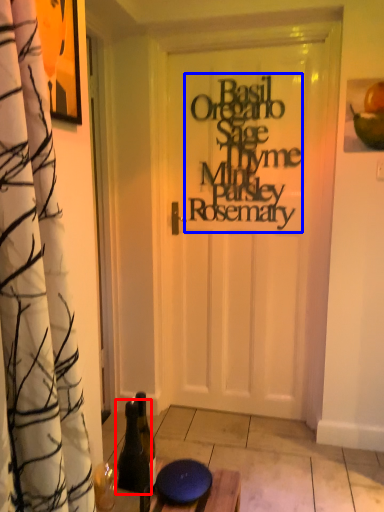
Question: Among these objects, which one is nearest to the camera, bottle (highlighted by a red box) or writing (highlighted by a blue box)?

Choices:
 (A) bottle
 (B) writing

Answer: (A)